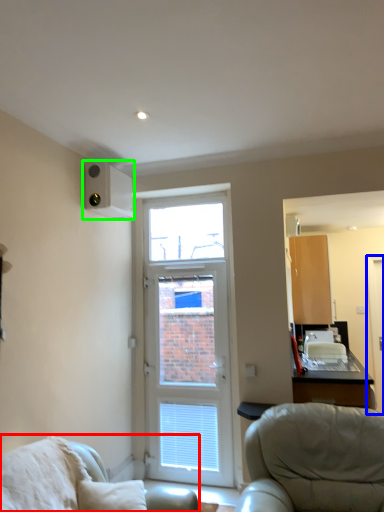
Question: Which object is positioned closest to chair (highlighted by a red box)? Select from screen door (highlighted by a blue box) and air conditioning (highlighted by a green box).

Choices:
 (A) screen door
 (B) air conditioning

Answer: (B)